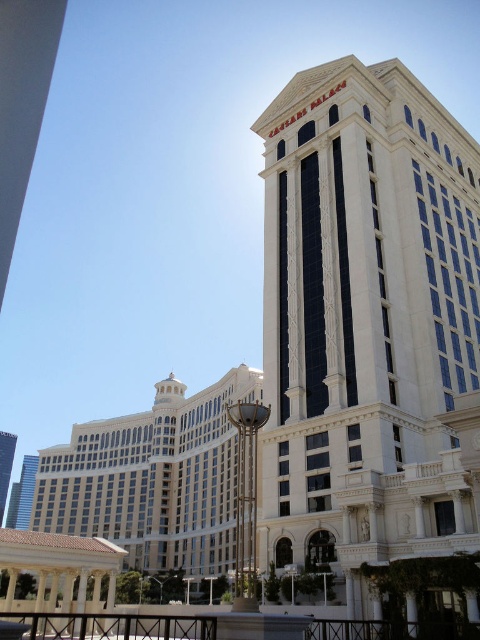
You are an architect analyzing the layout of this grand architectural scene. You need to determine which object occupies more space in the image. Which one is larger in size between the beige stone building at lower left and the white marble tower at center?

The beige stone building at lower left has a larger size compared to the white marble tower at center, so the beige stone building at lower left occupies more space in the image.

You are standing in front of the Caesars Palace and want to take a photo that includes both the beige stone building at lower left and the white marble tower at center. Based on their positions, which building should you position closer to the left side of your camera frame to include both in the shot?

The beige stone building at lower left is to the right of the white marble tower at center. To include both in the shot, position the white marble tower at center closer to the left side of the camera frame so that the beige stone building at lower left, which is to its right, will naturally fall within the frame.